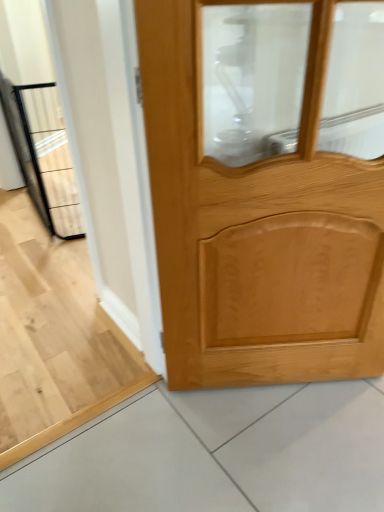
Question: From the image's perspective, is light brown wood door at center positioned above or below black metal elevator at left?

Choices:
 (A) above
 (B) below

Answer: (B)

Question: Visually, is light brown wood door at center positioned to the left or to the right of black metal elevator at left?

Choices:
 (A) right
 (B) left

Answer: (A)

Question: Does point (249, 268) appear closer or farther from the camera than point (62, 168)?

Choices:
 (A) closer
 (B) farther

Answer: (A)

Question: From the image's perspective, is black metal elevator at left above or below light brown wood door at center?

Choices:
 (A) above
 (B) below

Answer: (A)

Question: In terms of height, does black metal elevator at left look taller or shorter compared to light brown wood door at center?

Choices:
 (A) tall
 (B) short

Answer: (B)

Question: Considering the positions of black metal elevator at left and light brown wood door at center in the image, is black metal elevator at left bigger or smaller than light brown wood door at center?

Choices:
 (A) big
 (B) small

Answer: (A)

Question: In terms of width, does black metal elevator at left look wider or thinner when compared to light brown wood door at center?

Choices:
 (A) thin
 (B) wide

Answer: (B)